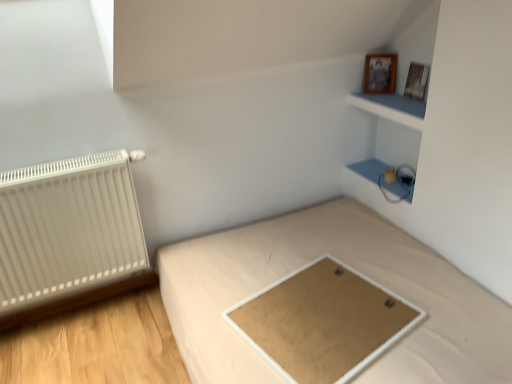
The width and height of the screenshot is (512, 384). I want to click on vacant point to the right of matte brown board at center, so click(x=436, y=306).